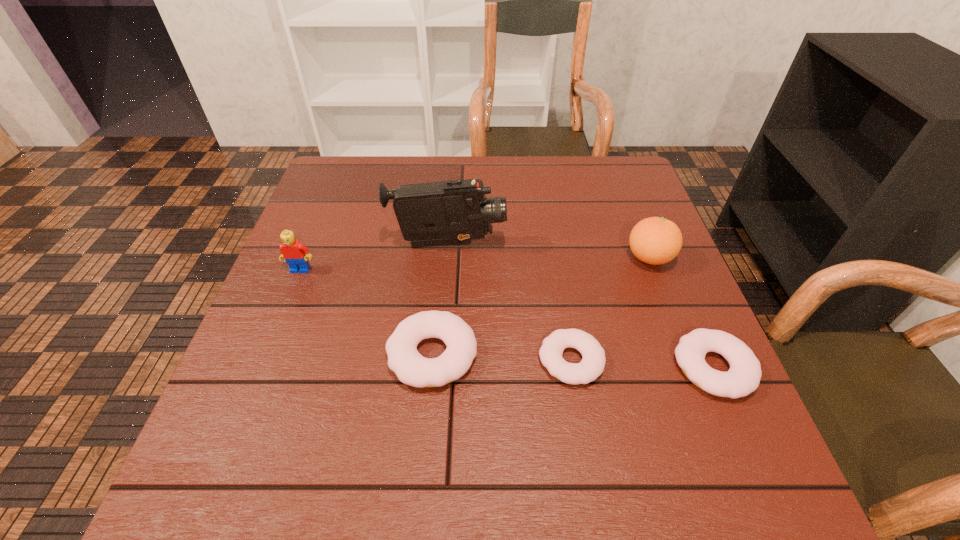
Where is `free space that satisfies the following two spatial constraints: 1. on the front-facing side of the tallest object; 2. on the face of the Lego`? free space that satisfies the following two spatial constraints: 1. on the front-facing side of the tallest object; 2. on the face of the Lego is located at coordinates (445, 269).

I want to click on free space that satisfies the following two spatial constraints: 1. on the front-facing side of the camcorder; 2. on the face of the leftmost object, so click(445, 269).

At what (x,y) coordinates should I click in order to perform the action: click on free spot that satisfies the following two spatial constraints: 1. on the front-facing side of the camcorder; 2. on the back side of the second tallest doughnut. Please return your answer as a coordinate pair (x, y). Looking at the image, I should click on (439, 368).

Where is `vacant point that satisfies the following two spatial constraints: 1. on the face of the fifth tallest object; 2. on the left side of the Lego`? The height and width of the screenshot is (540, 960). vacant point that satisfies the following two spatial constraints: 1. on the face of the fifth tallest object; 2. on the left side of the Lego is located at coordinates (261, 368).